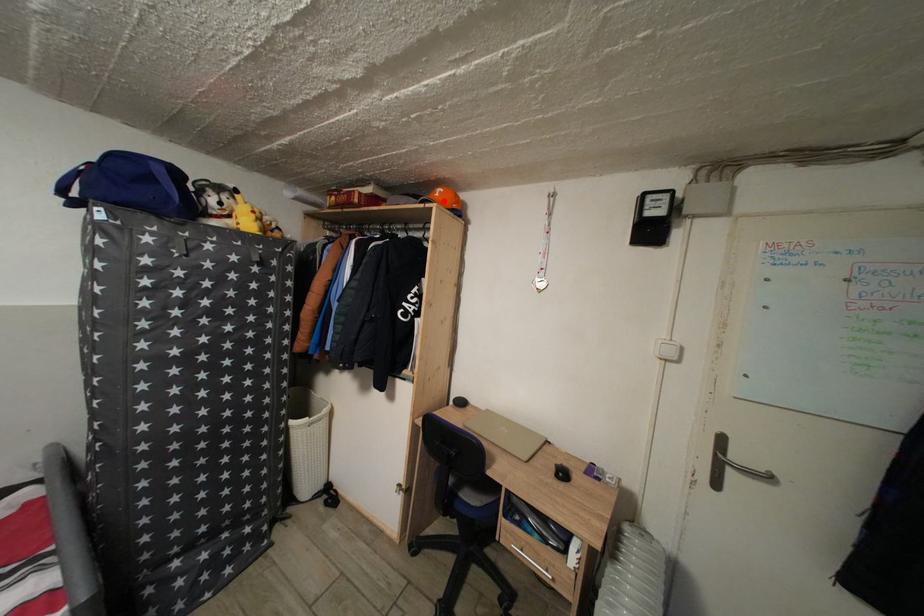
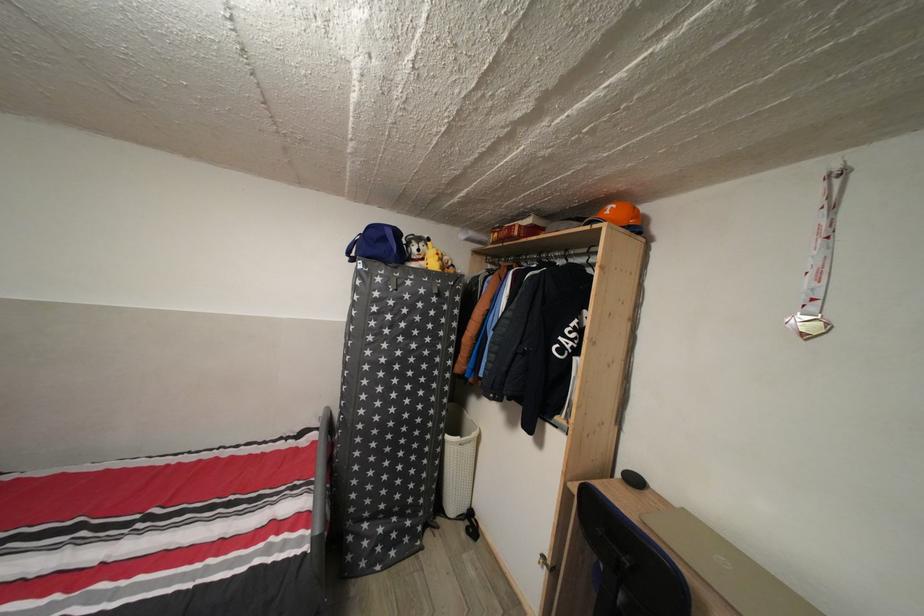
The point at the highlighted location is marked in the first image. Where is the corresponding point in the second image?

(614, 219)